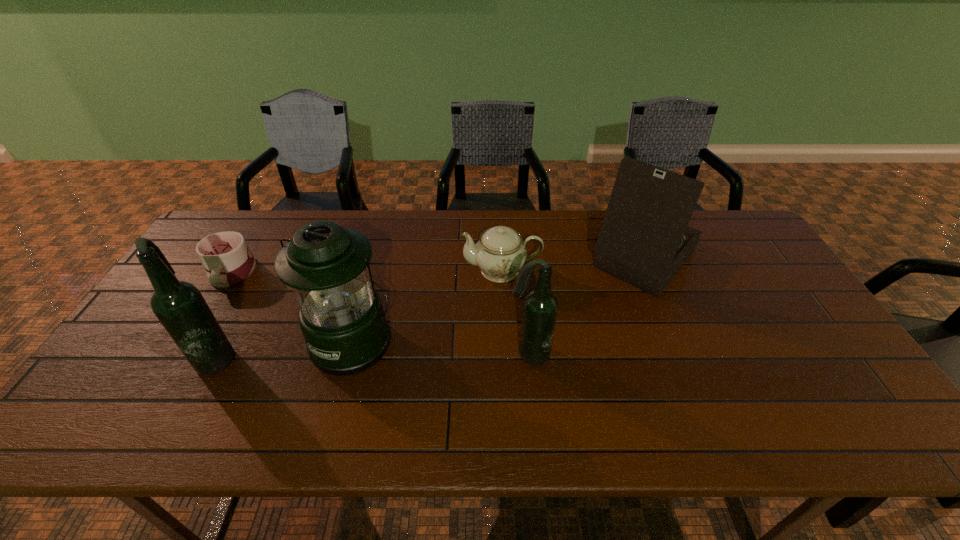
This screenshot has height=540, width=960. Identify the location of vacant space at the far edge of the desktop. (465, 239).

At what (x,y) coordinates should I click in order to perform the action: click on free space at the near edge. Please return your answer as a coordinate pair (x, y). Looking at the image, I should click on (670, 379).

In the image, there is a desktop. At what (x,y) coordinates should I click in order to perform the action: click on vacant space at the far left corner. Please return your answer as a coordinate pair (x, y). Looking at the image, I should click on (250, 220).

Locate an element on the screen. This screenshot has height=540, width=960. unoccupied area between the taller beer bottle and the shortest object is located at coordinates (225, 315).

The image size is (960, 540). Find the location of `vacant space that's between the fifth tallest object and the rightmost object`. vacant space that's between the fifth tallest object and the rightmost object is located at coordinates (572, 264).

Locate an element on the screen. The height and width of the screenshot is (540, 960). free space between the second shortest object and the fourth tallest object is located at coordinates (516, 312).

You are a GUI agent. You are given a task and a screenshot of the screen. Output one action in this format:
    pyautogui.click(x=<x>, y=<y>)
    Task: Click on the free space between the taller beer bottle and the phonograph record
    
    Given the screenshot: What is the action you would take?
    pyautogui.click(x=431, y=307)

Identify the location of free area in between the chinaware and the rightmost object. pyautogui.click(x=572, y=264).

You are a GUI agent. You are given a task and a screenshot of the screen. Output one action in this format:
    pyautogui.click(x=<x>, y=<y>)
    Task: Click on the unoccupied area between the right beer bottle and the phonograph record
    The height and width of the screenshot is (540, 960).
    Given the screenshot: What is the action you would take?
    pyautogui.click(x=587, y=306)

Locate an element on the screen. This screenshot has height=540, width=960. free space between the lantern and the taller beer bottle is located at coordinates (286, 349).